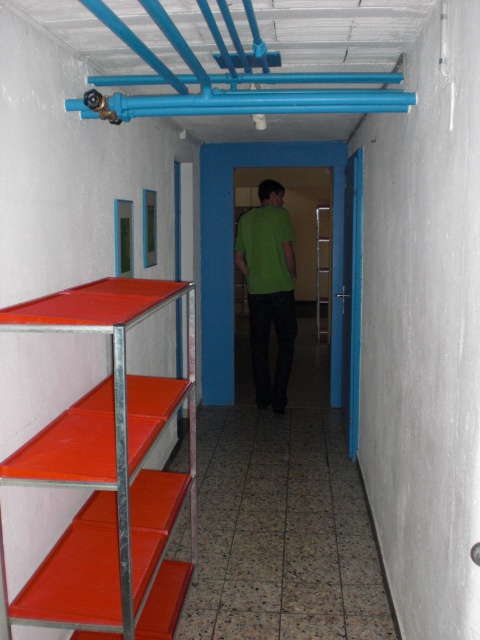
Is metallic red shelf at left bigger than green matte shirt at center?

Correct, metallic red shelf at left is larger in size than green matte shirt at center.

Who is more distant from viewer, (121, 556) or (253, 336)?

Point (253, 336)

The width and height of the screenshot is (480, 640). Describe the element at coordinates (104, 467) in the screenshot. I see `metallic red shelf at left` at that location.

This screenshot has height=640, width=480. Identify the location of metallic red shelf at left. (104, 467).

Who is more distant from viewer, (236,236) or (328,289)?

Positioned behind is point (328,289).

Image resolution: width=480 pixels, height=640 pixels. Find the location of `green matte shirt at center`. green matte shirt at center is located at coordinates (268, 289).

Can you confirm if metallic red shelf at left is wider than metallic silver ladder at center?

Yes, metallic red shelf at left is wider than metallic silver ladder at center.

Can you confirm if metallic red shelf at left is bigger than metallic silver ladder at center?

Actually, metallic red shelf at left might be smaller than metallic silver ladder at center.

Which is behind, point (154, 534) or point (315, 301)?

The point (315, 301) is behind.

You are a GUI agent. You are given a task and a screenshot of the screen. Output one action in this format:
    pyautogui.click(x=<x>, y=<y>)
    Task: Click on the metallic red shelf at left
    
    Given the screenshot: What is the action you would take?
    pyautogui.click(x=104, y=467)